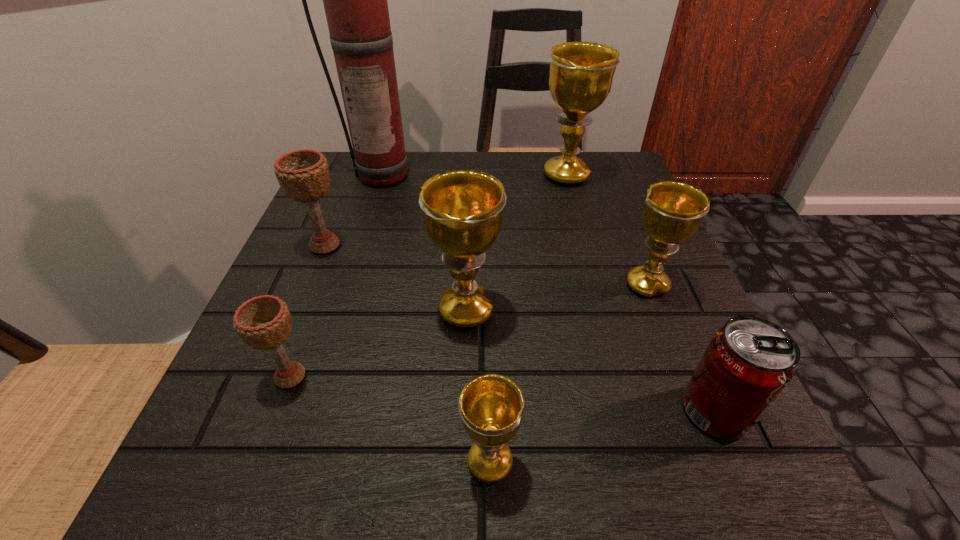
In order to click on free spot between the sixth shortest object and the nearer beige chalice in this screenshot , I will do `click(378, 343)`.

Find the location of a particular element. This screenshot has width=960, height=540. free space that is in between the red fire extinguisher and the nearest chalice is located at coordinates (437, 318).

Locate an element on the screen. vacant space that is in between the farthest chalice and the third biggest gold chalice is located at coordinates (607, 231).

What are the coordinates of `vacant region between the nearer beige chalice and the farthest chalice` in the screenshot? It's located at (428, 276).

Identify the location of vacant region between the smaller beige chalice and the nearest chalice. The width and height of the screenshot is (960, 540). (390, 419).

This screenshot has height=540, width=960. I want to click on unoccupied position between the fifth shortest chalice and the red fire extinguisher, so click(x=425, y=241).

I want to click on object that ranks as the fourth closest to the smaller beige chalice, so click(355, 0).

At what (x,y) coordinates should I click in order to perform the action: click on object that is the sixth closest to the third biggest gold chalice. Please return your answer as a coordinate pair (x, y). Looking at the image, I should click on (264, 322).

This screenshot has width=960, height=540. What are the coordinates of `the third closest chalice to the smaller beige chalice` in the screenshot? It's located at (491, 406).

Choose which chalice is the third nearest neighbor to the fifth farthest chalice. Please provide its 2D coordinates. Your answer should be formatted as a tuple, i.e. [(x, y)], where the tuple contains the x and y coordinates of a point satisfying the conditions above.

[(491, 406)]